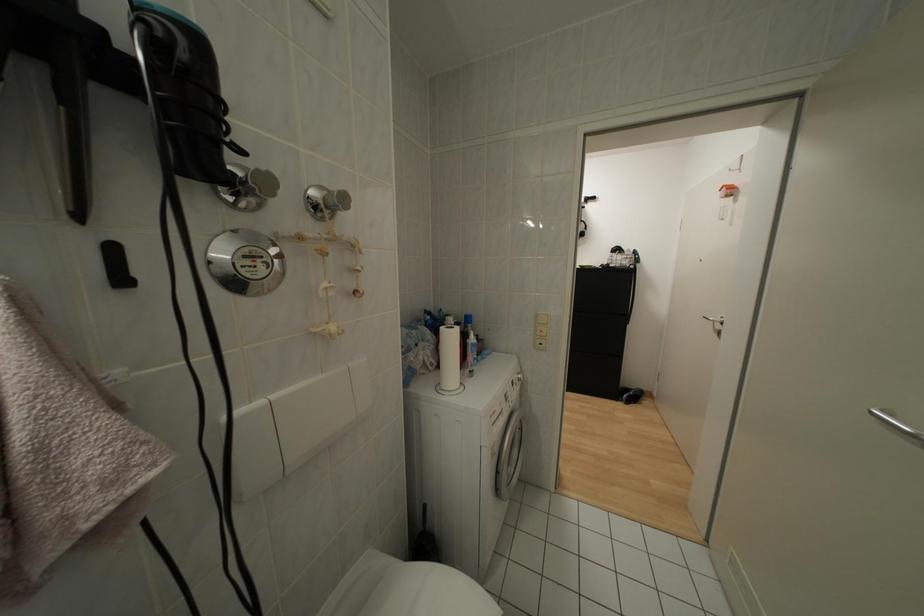
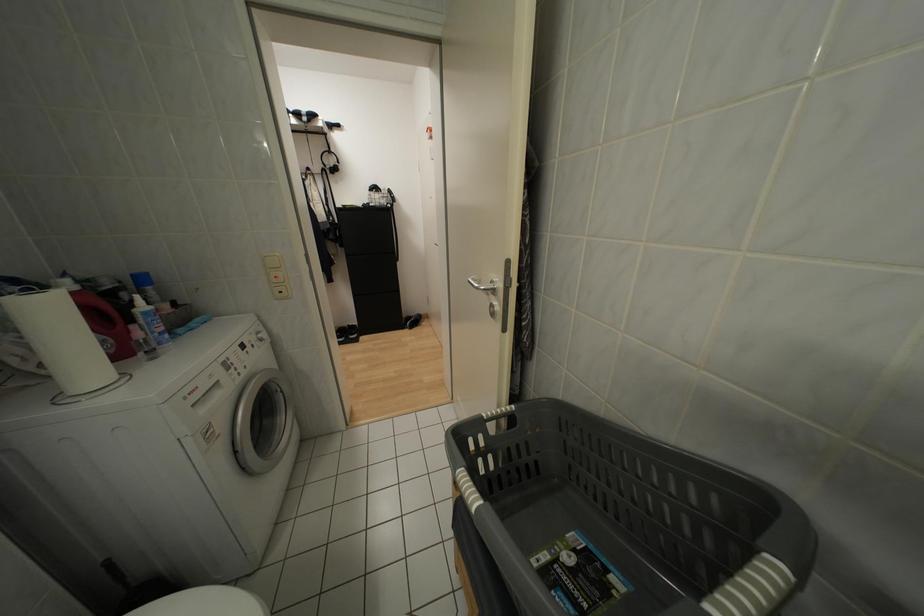
Question: How did the camera likely rotate?

Choices:
 (A) Left
 (B) Right
 (C) Up
 (D) Down

Answer: (B)